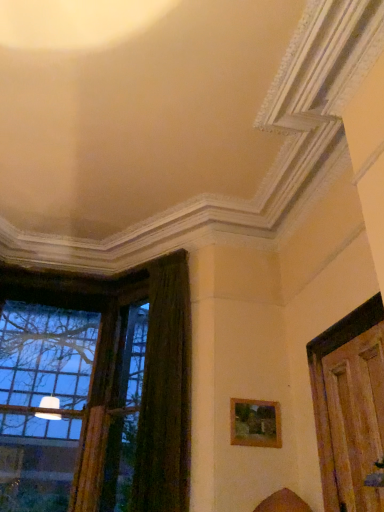
Question: Which is correct: clear glass window at left is inside wooden door at right, or outside of it?

Choices:
 (A) outside
 (B) inside

Answer: (A)

Question: From a real-world perspective, relative to wooden door at right, is clear glass window at left vertically above or below?

Choices:
 (A) above
 (B) below

Answer: (A)

Question: Which object is the closest to the clear glass window at left?

Choices:
 (A) wooden door at right
 (B) dark green velvet curtain at left
 (C) wooden picture frame at lower right

Answer: (B)

Question: Considering the real-world distances, which object is farthest from the wooden door at right?

Choices:
 (A) clear glass window at left
 (B) wooden picture frame at lower right
 (C) dark green velvet curtain at left

Answer: (A)